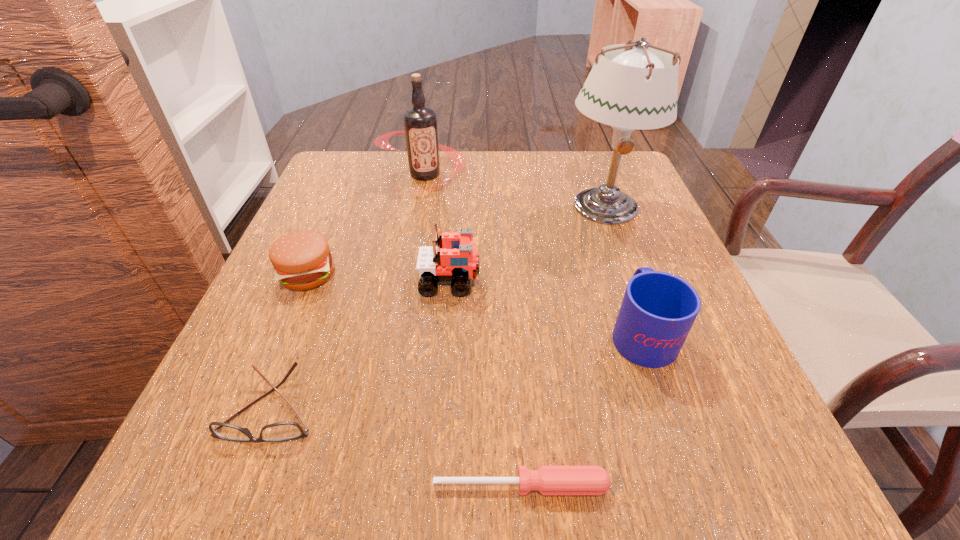
Locate an element on the screen. vacant space situated 0.270m on the label of the second tallest object is located at coordinates (407, 278).

Where is `free space located on the front-facing side of the Lego`? This screenshot has height=540, width=960. free space located on the front-facing side of the Lego is located at coordinates (648, 281).

Where is `free space located 0.310m on the side with the handle of the fifth farthest object`? free space located 0.310m on the side with the handle of the fifth farthest object is located at coordinates (596, 202).

Where is `vacant area situated on the side with the handle of the fifth farthest object`? Image resolution: width=960 pixels, height=540 pixels. vacant area situated on the side with the handle of the fifth farthest object is located at coordinates (600, 212).

Identify the location of vacant region located on the side with the handle of the fifth farthest object. (615, 256).

Where is `free region located 0.120m on the right of the hamburger`? free region located 0.120m on the right of the hamburger is located at coordinates (402, 274).

The width and height of the screenshot is (960, 540). Identify the location of free spot located 0.310m on the left of the screwdriver. (182, 485).

Image resolution: width=960 pixels, height=540 pixels. I want to click on lampshade present at the far edge, so click(637, 89).

Locate an element on the screen. The width and height of the screenshot is (960, 540). root beer that is at the far edge is located at coordinates (420, 124).

Locate an element on the screen. spectacles that is at the near edge is located at coordinates (281, 431).